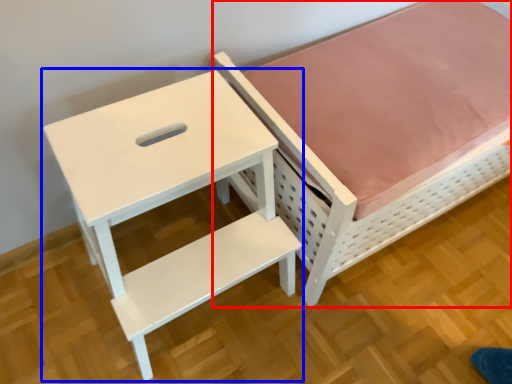
Question: Which of the following is the closest to the observer, furniture (highlighted by a red box) or table (highlighted by a blue box)?

Choices:
 (A) furniture
 (B) table

Answer: (B)